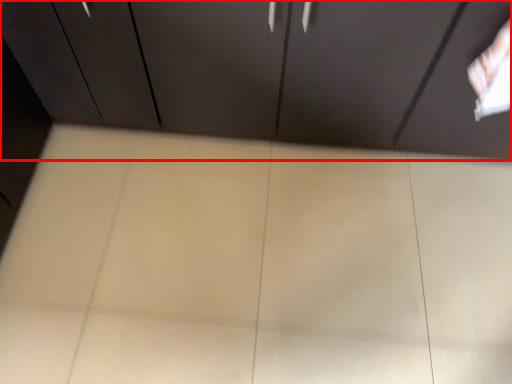
Question: From the image's perspective, what is the correct spatial positioning of cupboard (annotated by the red box) in reference to plywood?

Choices:
 (A) above
 (B) below

Answer: (A)